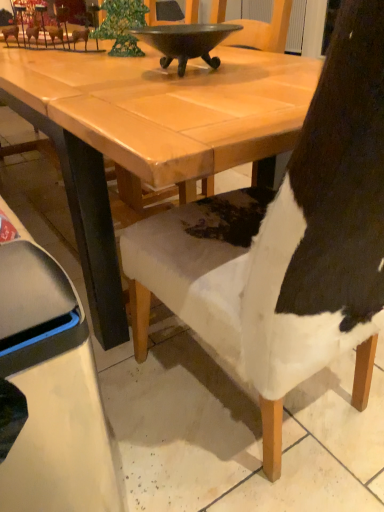
Find the location of a particular element. This screenshot has height=512, width=384. vacant space underneath shiny dark metal bowl at upper center (from a real-world perspective) is located at coordinates (183, 72).